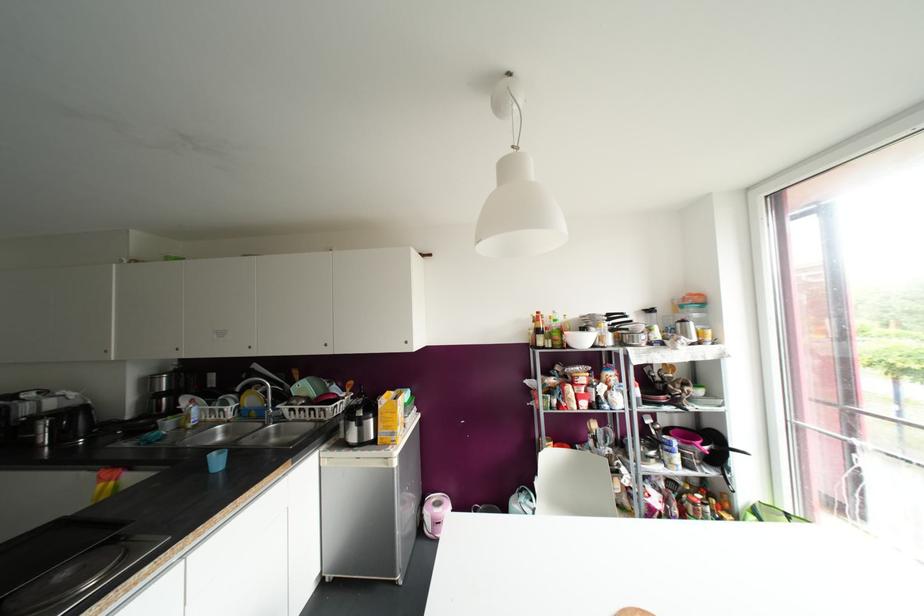
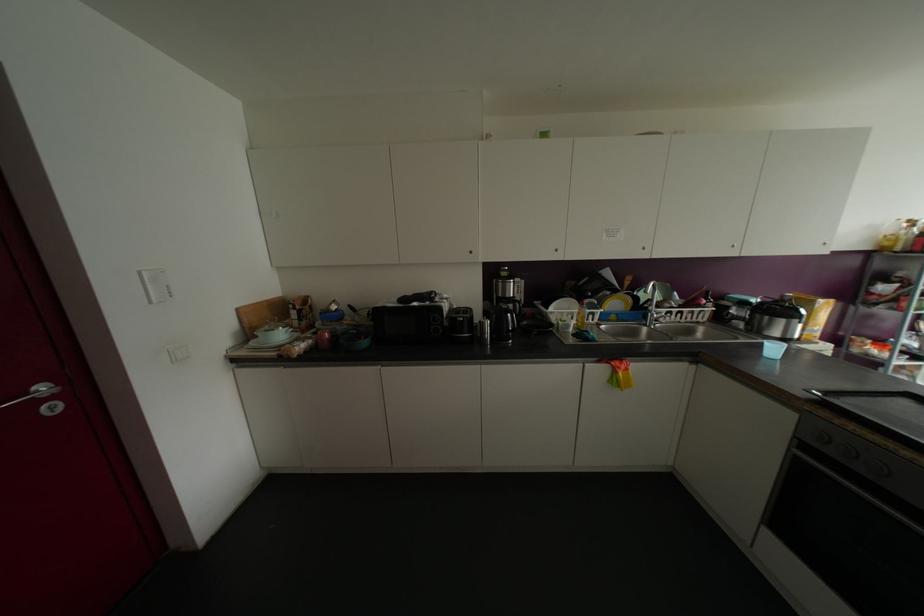
In the second image, find the point that corresponds to point (250, 399) in the first image.

(614, 302)